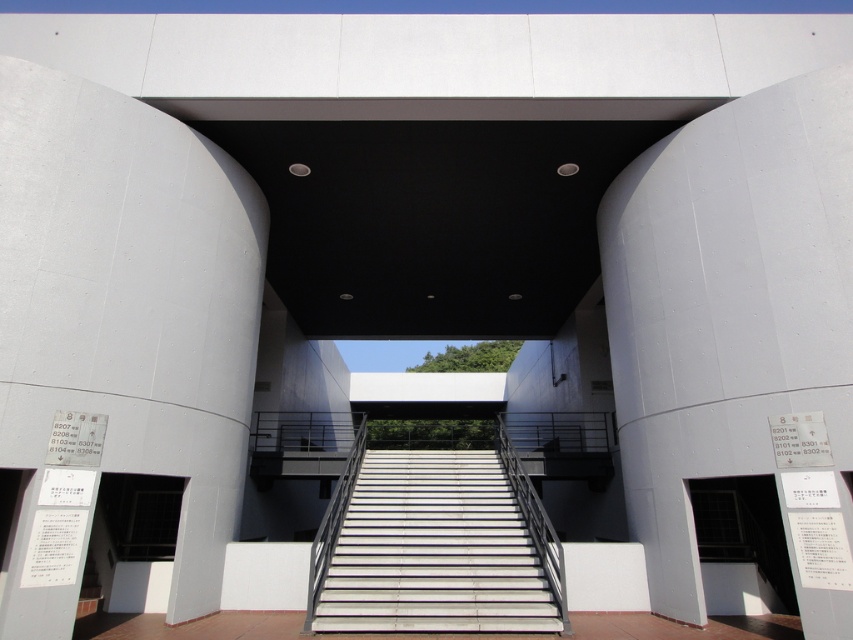
Is smooth concrete pillar at center bigger than white concrete stairs at center?

Correct, smooth concrete pillar at center is larger in size than white concrete stairs at center.

Can you confirm if smooth concrete pillar at center is positioned to the left of white concrete stairs at center?

Incorrect, smooth concrete pillar at center is not on the left side of white concrete stairs at center.

The width and height of the screenshot is (853, 640). What are the coordinates of `smooth concrete pillar at center` in the screenshot? It's located at (727, 304).

Locate an element on the screen. Image resolution: width=853 pixels, height=640 pixels. smooth concrete pillar at center is located at coordinates (727, 304).

Between smooth concrete pillar at left and smooth concrete pillar at center, which one appears on the right side from the viewer's perspective?

smooth concrete pillar at center is more to the right.

Which of these two, smooth concrete pillar at left or smooth concrete pillar at center, stands shorter?

smooth concrete pillar at left is shorter.

This screenshot has height=640, width=853. I want to click on smooth concrete pillar at left, so click(x=129, y=298).

Which is above, smooth concrete pillar at left or white matte door at lower right?

smooth concrete pillar at left is above.

Which is below, smooth concrete pillar at left or white matte door at lower right?

white matte door at lower right

You are a GUI agent. You are given a task and a screenshot of the screen. Output one action in this format:
    pyautogui.click(x=<x>, y=<y>)
    Task: Click on the smooth concrete pillar at left
    The image size is (853, 640).
    Given the screenshot: What is the action you would take?
    pyautogui.click(x=129, y=298)

At what (x,y) coordinates should I click in order to perform the action: click on smooth concrete pillar at left. Please return your answer as a coordinate pair (x, y). The height and width of the screenshot is (640, 853). Looking at the image, I should click on pyautogui.click(x=129, y=298).